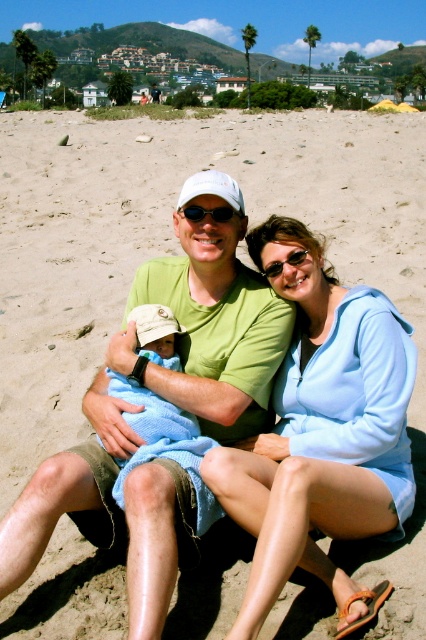
What is the color of the shirt worn by the person located at the coordinates point (166, 400) in the image?

The point (166, 400) indicates the green matte shirt at center, so the color is green.

You are a photographer standing at the camera position. You want to take a photo that includes both the point at coordinates point(x=129, y=298) and point(x=192, y=476). Which point will appear closer to the front of the photo?

Point(x=129, y=298) is further to the camera than point(x=192, y=476), so it will appear closer to the front of the photo.

You are a photographer trying to capture a clear shot of the light blue hoodie at center and the blue knitted blanket at center. Since you want to ensure both are in focus, you need to know which one is taller. Which object is taller?

The light blue hoodie at center is taller than the blue knitted blanket at center.